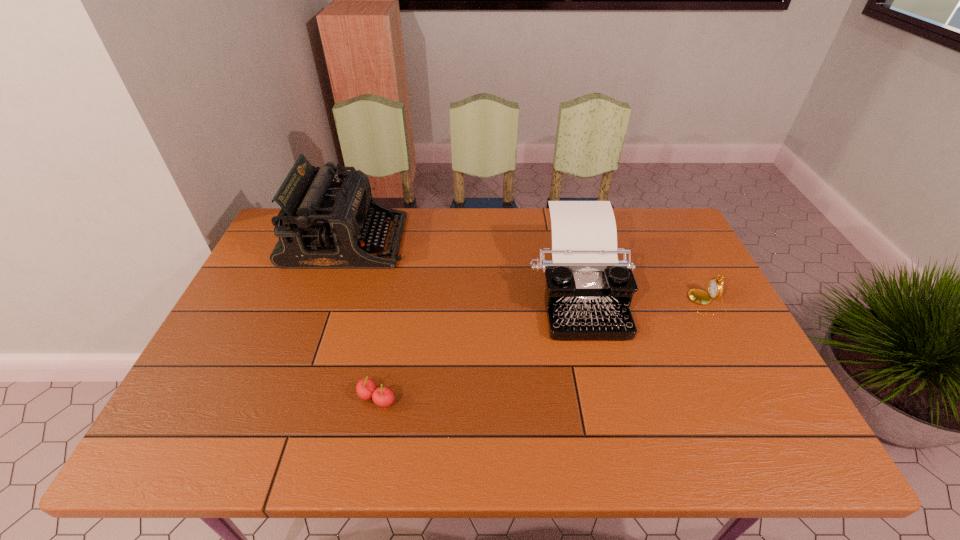
Where is `the taller typewriter`? the taller typewriter is located at coordinates (323, 224).

You are a GUI agent. You are given a task and a screenshot of the screen. Output one action in this format:
    pyautogui.click(x=<x>, y=<y>)
    Task: Click on the left typewriter
    The height and width of the screenshot is (540, 960).
    Given the screenshot: What is the action you would take?
    pyautogui.click(x=323, y=224)

Identify the location of the shorter typewriter. (588, 293).

At what (x,y) coordinates should I click in order to perform the action: click on the right typewriter. Please return your answer as a coordinate pair (x, y). The height and width of the screenshot is (540, 960). Looking at the image, I should click on (588, 293).

Find the location of a particular element. The image size is (960, 540). the rightmost object is located at coordinates (715, 288).

This screenshot has height=540, width=960. What are the coordinates of `the nearest object` in the screenshot? It's located at (366, 389).

Image resolution: width=960 pixels, height=540 pixels. I want to click on the shortest object, so click(x=366, y=389).

You are a GUI agent. You are given a task and a screenshot of the screen. Output one action in this format:
    pyautogui.click(x=<x>, y=<y>)
    Task: Click on the vacant space located on the keyboard of the tallest object
    The width and height of the screenshot is (960, 540).
    Given the screenshot: What is the action you would take?
    pyautogui.click(x=482, y=241)

The width and height of the screenshot is (960, 540). I want to click on free space located 0.250m on the keys of the shorter typewriter, so click(x=610, y=433).

You are a GUI agent. You are given a task and a screenshot of the screen. Output one action in this format:
    pyautogui.click(x=<x>, y=<y>)
    Task: Click on the free space located 0.260m on the face of the pocket watch
    The image size is (960, 540).
    Given the screenshot: What is the action you would take?
    pyautogui.click(x=598, y=303)